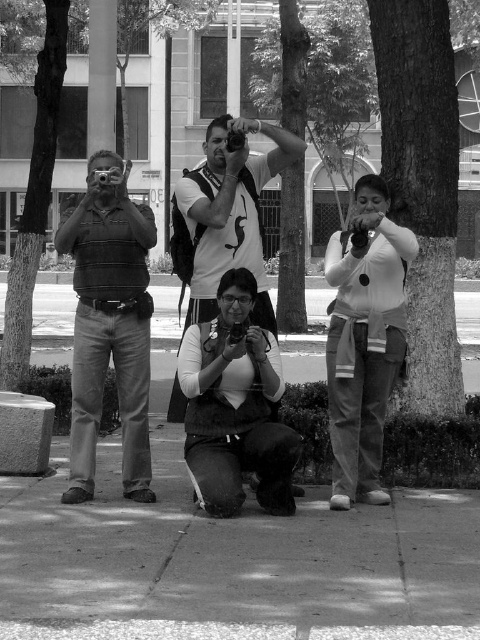
Question: Is matte black camera at left bigger than matte black camera at center?

Choices:
 (A) no
 (B) yes

Answer: (B)

Question: Is rough bark tree at right in front of matte black camera at left?

Choices:
 (A) no
 (B) yes

Answer: (A)

Question: Which object is farther from the camera taking this photo?

Choices:
 (A) rough bark tree at right
 (B) rough bark tree at center
 (C) matte white t-shirt at center
 (D) smooth concrete pavement at center

Answer: (A)

Question: Which of these objects is positioned farthest from the rough bark tree at right?

Choices:
 (A) smooth concrete pavement at center
 (B) rough bark tree at center
 (C) smooth bark tree at left
 (D) matte white t-shirt at center

Answer: (B)

Question: Which object is the closest to the matte black camera at center?

Choices:
 (A) smooth concrete pavement at center
 (B) rough bark tree at center

Answer: (A)

Question: Can you confirm if matte black camera at center is positioned to the left of smooth bark tree at left?

Choices:
 (A) no
 (B) yes

Answer: (A)